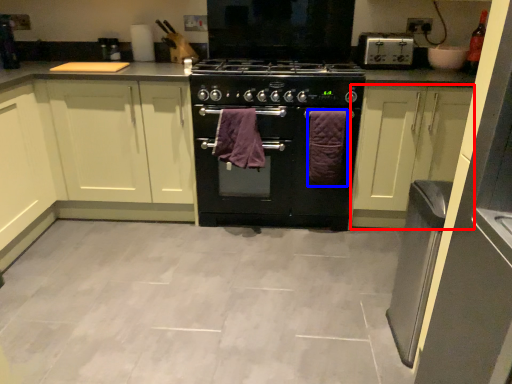
Question: Which object is closer to the camera taking this photo, cabinetry (highlighted by a red box) or bath towel (highlighted by a blue box)?

Choices:
 (A) cabinetry
 (B) bath towel

Answer: (A)